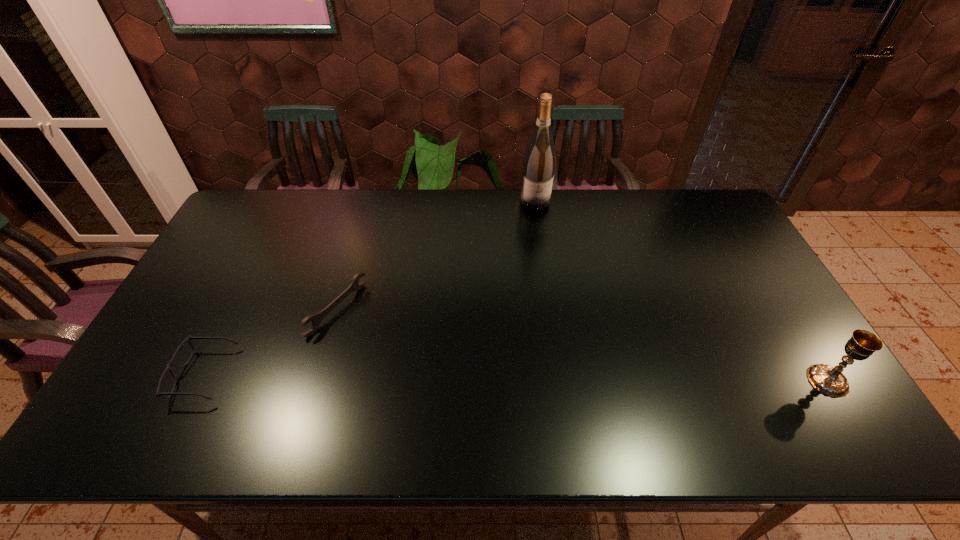
The width and height of the screenshot is (960, 540). I want to click on object situated at the near left corner, so click(158, 393).

Where is `object at the near right corner`? Image resolution: width=960 pixels, height=540 pixels. object at the near right corner is located at coordinates (x=829, y=380).

You are a GUI agent. You are given a task and a screenshot of the screen. Output one action in this format:
    pyautogui.click(x=<x>, y=<y>)
    Task: Click on the vacant area at the far edge
    This screenshot has width=960, height=540.
    Given the screenshot: What is the action you would take?
    pyautogui.click(x=540, y=219)

Where is `free region at the near edge`? Image resolution: width=960 pixels, height=540 pixels. free region at the near edge is located at coordinates (324, 395).

In order to click on free space at the right edge in this screenshot , I will do `click(754, 291)`.

The width and height of the screenshot is (960, 540). I want to click on vacant space at the far left corner of the desktop, so click(x=291, y=191).

In the image, there is a desktop. Where is `blank space at the near right corner`? Image resolution: width=960 pixels, height=540 pixels. blank space at the near right corner is located at coordinates (806, 383).

Find the location of `blank region between the rightmost object and the leftmost object`. blank region between the rightmost object and the leftmost object is located at coordinates (516, 377).

Where is `vacant space that's between the wrench and the second object from right to left`? This screenshot has width=960, height=540. vacant space that's between the wrench and the second object from right to left is located at coordinates (436, 255).

You are a GUI agent. You are given a task and a screenshot of the screen. Output one action in this format:
    pyautogui.click(x=<x>, y=<y>)
    Task: Click on the free spot between the farthest object and the rightmost object
    This screenshot has height=540, width=960.
    Given the screenshot: What is the action you would take?
    [682, 291]